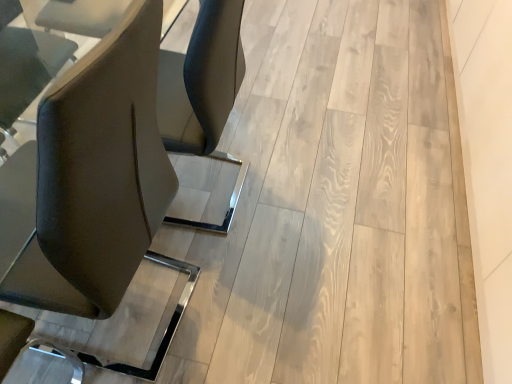
Question: Is matte black chair at left to the left of natural wood floor at center from the viewer's perspective?

Choices:
 (A) no
 (B) yes

Answer: (B)

Question: Does matte black chair at left appear on the right side of natural wood floor at center?

Choices:
 (A) no
 (B) yes

Answer: (A)

Question: Does matte black chair at left have a lesser width compared to natural wood floor at center?

Choices:
 (A) yes
 (B) no

Answer: (A)

Question: From a real-world perspective, is matte black chair at left on natural wood floor at center?

Choices:
 (A) yes
 (B) no

Answer: (A)

Question: Does matte black chair at left touch natural wood floor at center?

Choices:
 (A) yes
 (B) no

Answer: (B)

Question: From the image's perspective, is matte black chair at left located above natural wood floor at center?

Choices:
 (A) no
 (B) yes

Answer: (A)

Question: From a real-world perspective, is natural wood floor at center positioned over matte black chair at left based on gravity?

Choices:
 (A) no
 (B) yes

Answer: (A)

Question: Considering the relative positions of natural wood floor at center and matte black chair at left in the image provided, is natural wood floor at center to the right of matte black chair at left from the viewer's perspective?

Choices:
 (A) no
 (B) yes

Answer: (B)

Question: Does natural wood floor at center turn towards matte black chair at left?

Choices:
 (A) no
 (B) yes

Answer: (B)

Question: Is natural wood floor at center bigger than matte black chair at left?

Choices:
 (A) yes
 (B) no

Answer: (A)

Question: Does natural wood floor at center come behind matte black chair at left?

Choices:
 (A) yes
 (B) no

Answer: (A)

Question: Is natural wood floor at center not inside matte black chair at left?

Choices:
 (A) yes
 (B) no

Answer: (A)

Question: From the image's perspective, is matte black chair at left positioned above or below natural wood floor at center?

Choices:
 (A) below
 (B) above

Answer: (A)